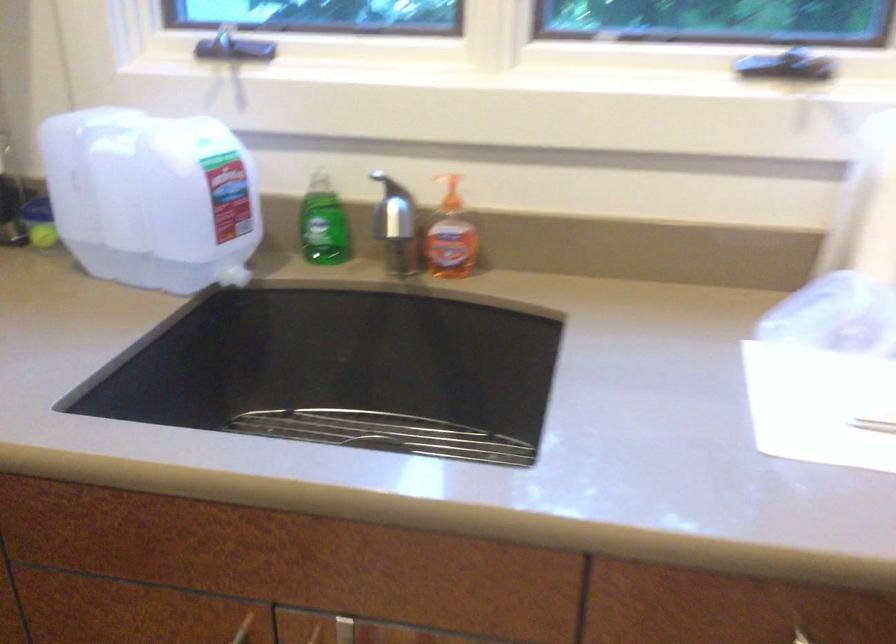
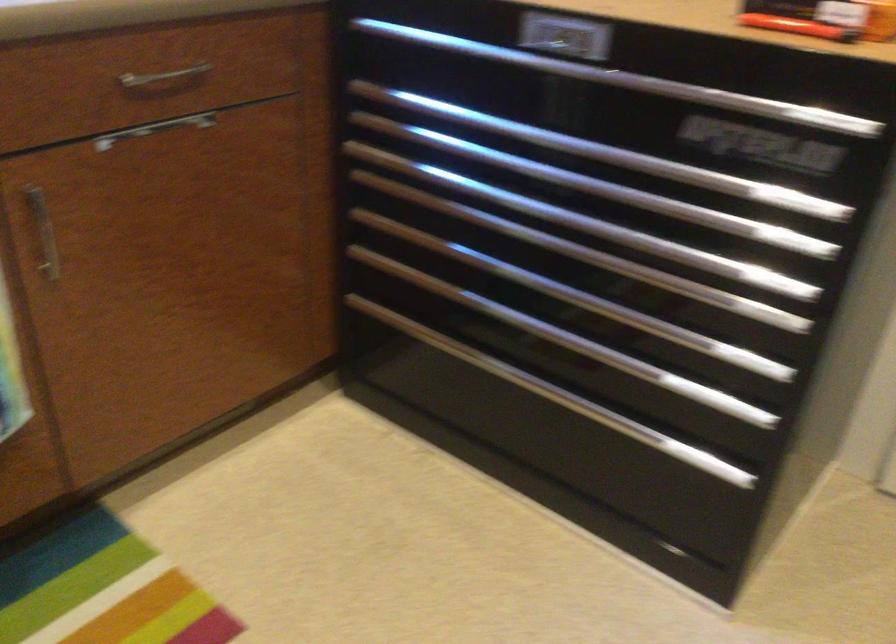
Based on the continuous images, in which direction is the camera rotating?

The camera's rotation is toward right-down.